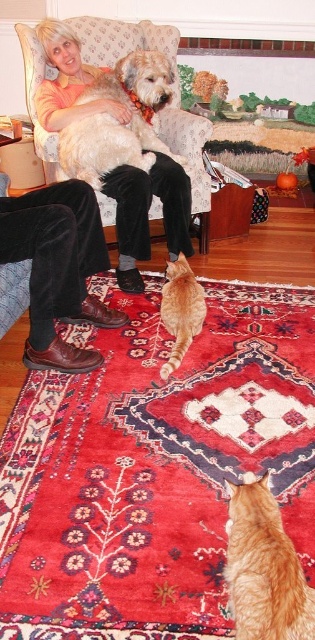
You are a pet photographer and need to position a camera to capture both the tabby fur cat at lower center and the soft golden fur at center. Based on their positions, which animal should you focus on first to ensure both are in frame?

The tabby fur cat at lower center is in front of the soft golden fur at center, so you should focus on the soft golden fur at center first to ensure both are in frame.

You are a pet photographer who wants to capture a group photo of the tabby fur cat at lower center and the soft golden fur at center. Since you want to ensure both pets are visible, which pet requires more space in the frame to accommodate its size?

The soft golden fur at center requires more space in the frame because its width is greater than the tabby fur cat at lower center.